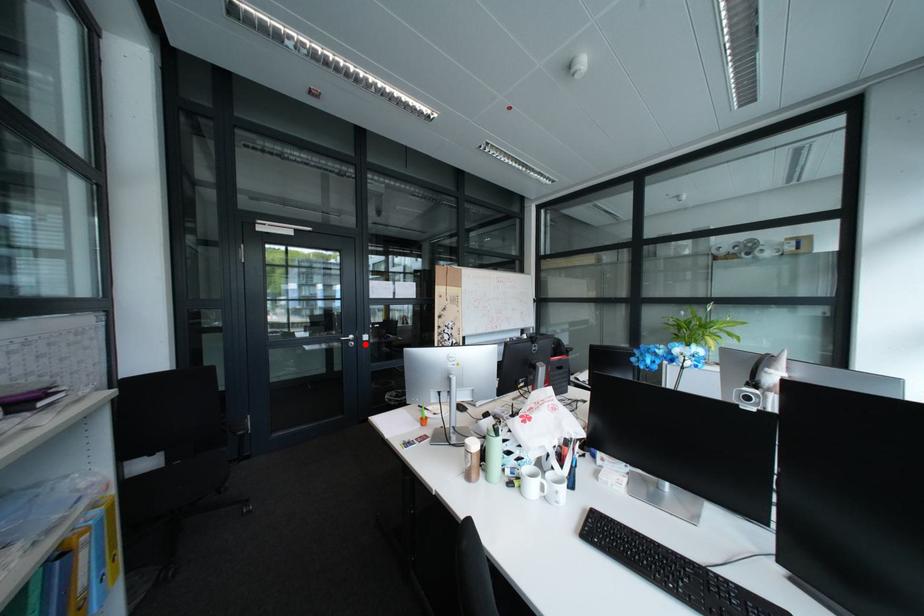
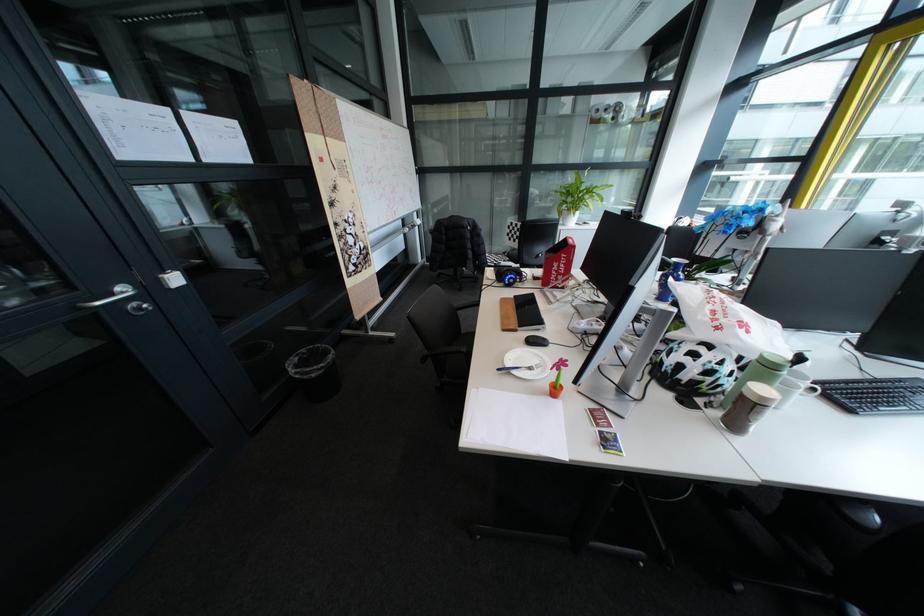
Question: I am providing you with two images of the same scene from different viewpoints. In image1, a red point is highlighted. Considering the same 3D point in image2, which of the following is correct?

Choices:
 (A) It is closer
 (B) It is farther

Answer: (B)